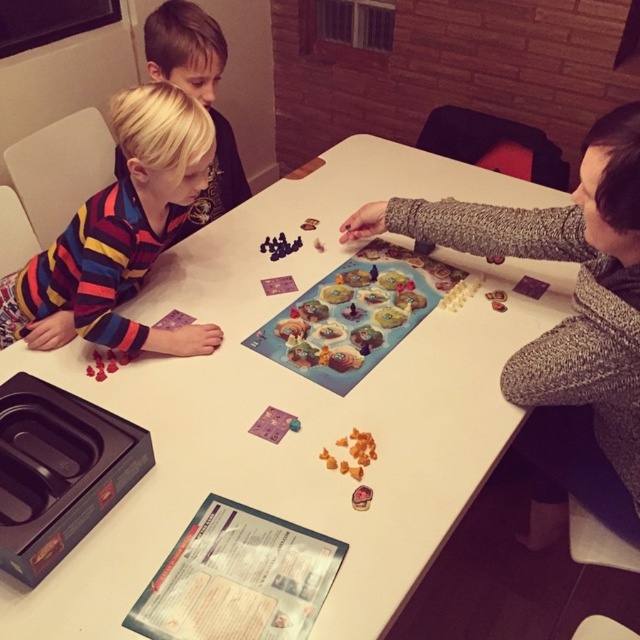
Describe the element at coordinates (563, 324) in the screenshot. The height and width of the screenshot is (640, 640). I see `matte gray sweater at upper right` at that location.

Who is lower down, matte gray sweater at upper right or striped fabric shirt at left?

Positioned lower is matte gray sweater at upper right.

What do you see at coordinates (563, 324) in the screenshot? I see `matte gray sweater at upper right` at bounding box center [563, 324].

This screenshot has height=640, width=640. Identify the location of matte gray sweater at upper right. (563, 324).

Which of these two, matte gray sweater at upper right or blonde hair at left, stands shorter?

With less height is blonde hair at left.

Which of these two, matte gray sweater at upper right or blonde hair at left, stands taller?

Standing taller between the two is matte gray sweater at upper right.

You are a GUI agent. You are given a task and a screenshot of the screen. Output one action in this format:
    pyautogui.click(x=<x>, y=<y>)
    Task: Click on the matte gray sweater at upper right
    
    Given the screenshot: What is the action you would take?
    pyautogui.click(x=563, y=324)

In order to click on matte gray sweater at upper right in this screenshot , I will do `click(563, 324)`.

Is point (497, 220) behind point (280, 336)?

No, it is in front of (280, 336).

The width and height of the screenshot is (640, 640). What do you see at coordinates (563, 324) in the screenshot?
I see `matte gray sweater at upper right` at bounding box center [563, 324].

Find the location of `matte gray sweater at upper right`. matte gray sweater at upper right is located at coordinates (563, 324).